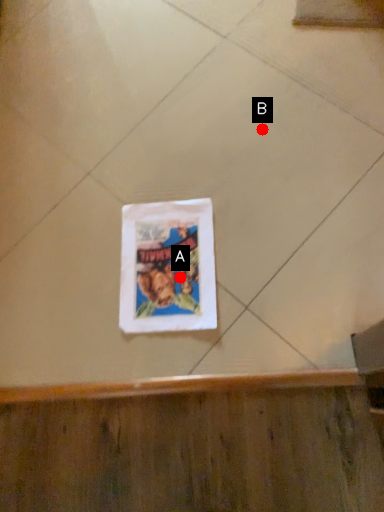
Question: Two points are circled on the image, labeled by A and B beside each circle. Which of the following is the closest to the observer?

Choices:
 (A) A is closer
 (B) B is closer

Answer: (A)